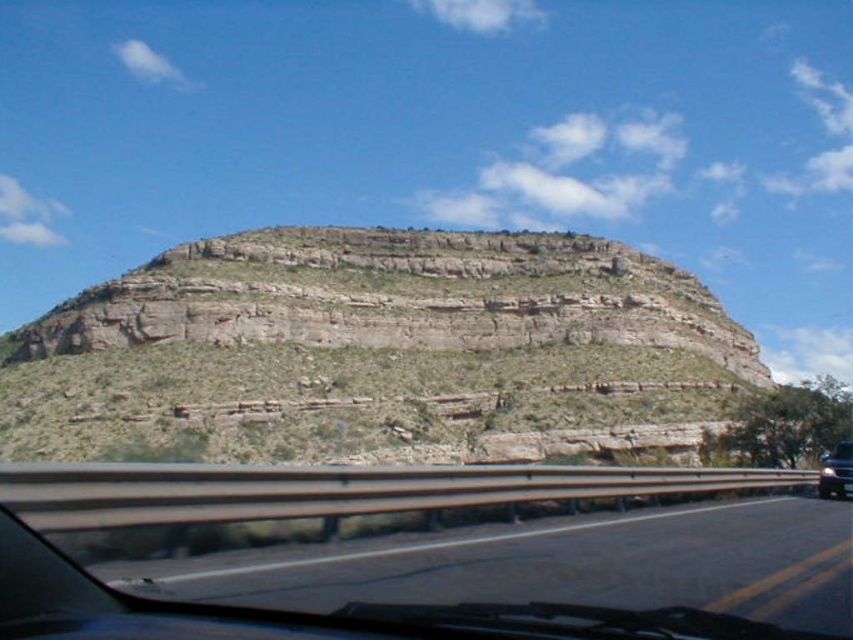
Can you confirm if brown rocky mountain at center is taller than black glossy car at right?

Yes, brown rocky mountain at center is taller than black glossy car at right.

Who is lower down, brown rocky mountain at center or black glossy car at right?

black glossy car at right is below.

Where is `brown rocky mountain at center`? The height and width of the screenshot is (640, 853). brown rocky mountain at center is located at coordinates (376, 353).

Is transparent glass car window at center in front of black glossy car at right?

Yes, transparent glass car window at center is closer to the viewer.

Who is shorter, transparent glass car window at center or black glossy car at right?

transparent glass car window at center is shorter.

Image resolution: width=853 pixels, height=640 pixels. What do you see at coordinates (311, 516) in the screenshot?
I see `transparent glass car window at center` at bounding box center [311, 516].

This screenshot has width=853, height=640. In order to click on transparent glass car window at center in this screenshot , I will do `click(311, 516)`.

Is point (553, 340) positioned after point (607, 627)?

Yes.

Can you confirm if brown rocky mountain at center is bigger than transparent glass car window at center?

Indeed, brown rocky mountain at center has a larger size compared to transparent glass car window at center.

Which is in front, point (218, 248) or point (561, 490)?

Point (561, 490) is more forward.

The image size is (853, 640). What are the coordinates of `brown rocky mountain at center` in the screenshot? It's located at (376, 353).